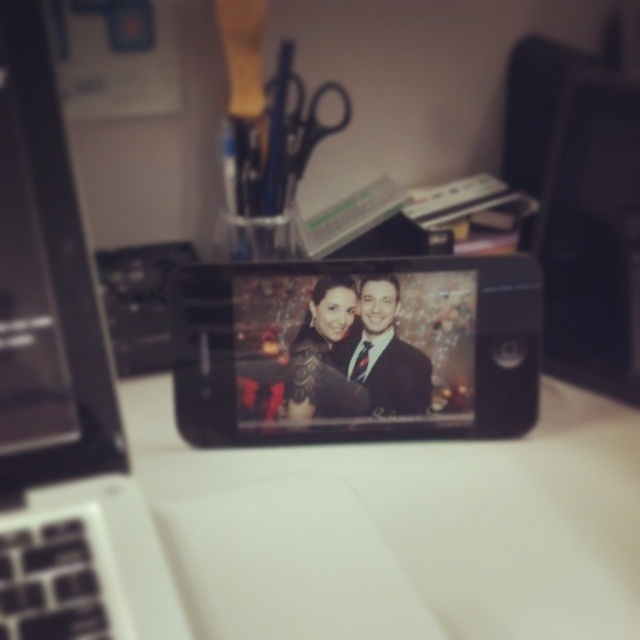
You are organizing a small event and need to place a 10 cm tall candle on the white matte table at center. However, there are black metallic scissors at upper center on the table. Considering the height of the table, will the candle be stable?

The white matte table at center has a lesser height compared to black metallic scissors at upper center. Since the table is shorter than the scissors, placing a 10 cm tall candle on it might be unstable as the scissors could knock it over if moved.

You are organizing a workspace and need to move items from the white matte table at center to the black plastic laptop at left. Which item should you move first if you want to start with the one closer to the laptop?

The white matte table at center is located below the black plastic laptop at left, so the item on the table closer to the laptop would be the one to move first. However, since the table is below the laptop, you might need to adjust their positions to access the items properly.

You are looking at the smartphone screen showing the photo of the man and the woman. There are two points marked on the screen at coordinates point (x=241, y=552) and point (x=93, y=532). From your perspective, which point is closer to you?

Point (x=93, y=532) is closer to you because the description states that point (x=241, y=552) is behind point (x=93, y=532).